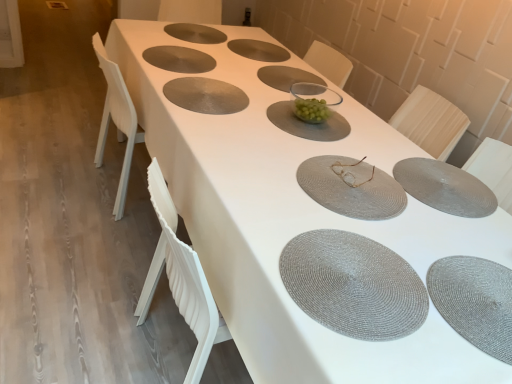
At what (x,y) coordinates should I click in order to perform the action: click on free spot in front of gray woven placemat at center, the 2th tableware in the bottom-to-top sequence. Please return your answer as a coordinate pair (x, y). The width and height of the screenshot is (512, 384). Looking at the image, I should click on (449, 229).